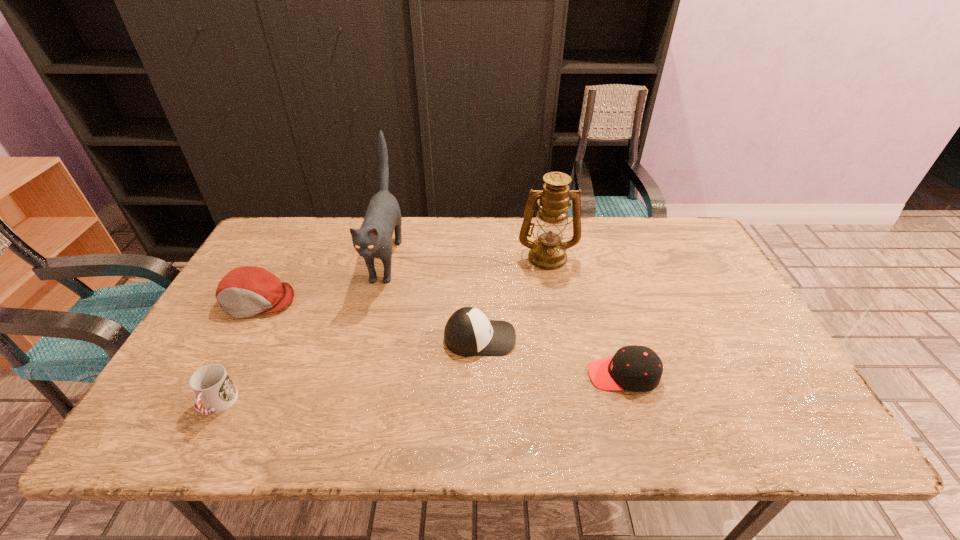
Locate an element on the screen. This screenshot has width=960, height=540. vacant space at the far edge of the desktop is located at coordinates (441, 220).

The image size is (960, 540). Identify the location of vacant space at the near edge of the desktop. (568, 427).

In the image, there is a desktop. Where is `free space at the left edge`? The width and height of the screenshot is (960, 540). free space at the left edge is located at coordinates (234, 321).

The height and width of the screenshot is (540, 960). What are the coordinates of `blank area at the right edge` in the screenshot? It's located at point(726,359).

Where is `free space between the leftmost cap and the rightmost cap`? Image resolution: width=960 pixels, height=540 pixels. free space between the leftmost cap and the rightmost cap is located at coordinates (441, 338).

Where is `vacant region between the leftmost cap and the third object from left to right`? vacant region between the leftmost cap and the third object from left to right is located at coordinates (323, 280).

Locate an element on the screen. free space between the leftmost cap and the cat is located at coordinates (323, 280).

Find the location of `free space between the second tallest object and the fourth object from left to right`. free space between the second tallest object and the fourth object from left to right is located at coordinates (x=514, y=297).

The width and height of the screenshot is (960, 540). Identify the location of empty space between the cup and the second tallest object. (383, 330).

The width and height of the screenshot is (960, 540). Identify the location of free spot between the leftmost cap and the fourth object from left to right. (370, 319).